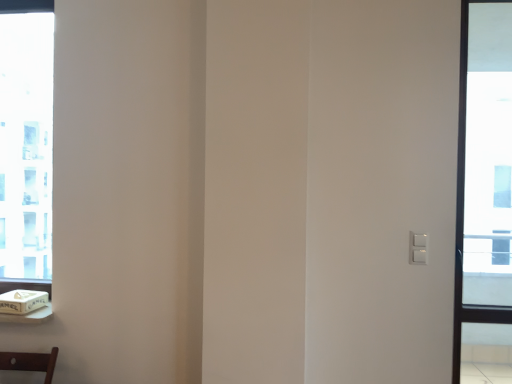
The height and width of the screenshot is (384, 512). Describe the element at coordinates (484, 184) in the screenshot. I see `transparent glass window at right, the first window from the front` at that location.

Describe the element at coordinates (26, 143) in the screenshot. I see `clear glass window at left, arranged as the second window when viewed from the front` at that location.

Find the location of `transparent glass window at right, which appears as the second window when viewed from the back`. transparent glass window at right, which appears as the second window when viewed from the back is located at coordinates pos(484,184).

Which object is wider, transparent glass window at right, arranged as the 1th window when viewed from the right, or clear glass window at left, the 2th window in the right-to-left sequence?

Wider between the two is transparent glass window at right, arranged as the 1th window when viewed from the right.

Are transparent glass window at right, the 2th window viewed from the left, and clear glass window at left, positioned as the first window in back-to-front order, far apart?

Yes, transparent glass window at right, the 2th window viewed from the left, and clear glass window at left, positioned as the first window in back-to-front order, are quite far apart.

From a real-world perspective, is white cardboard box at lower left below clear glass window at left, the 1th window positioned from the left?

Yes.

Is white cardboard box at lower left at the left side of clear glass window at left, the 1th window positioned from the left?

No, white cardboard box at lower left is not to the left of clear glass window at left, the 1th window positioned from the left.

Does white cardboard box at lower left come behind clear glass window at left, arranged as the second window when viewed from the front?

No.

Is clear glass window at left, the 2th window in the right-to-left sequence, surrounded by white cardboard box at lower left?

No, white cardboard box at lower left does not contain clear glass window at left, the 2th window in the right-to-left sequence.

Is the depth of clear glass window at left, the 1th window positioned from the left, greater than that of white cardboard box at lower left?

That is True.

From the image's perspective, is clear glass window at left, the 2th window in the right-to-left sequence, above or below white cardboard box at lower left?

Based on their image positions, clear glass window at left, the 2th window in the right-to-left sequence, is located above white cardboard box at lower left.

Can you confirm if clear glass window at left, positioned as the first window in back-to-front order, is positioned to the left of transparent glass window at right, the first window from the front?

Yes.

Is clear glass window at left, arranged as the second window when viewed from the front, oriented towards transparent glass window at right, which appears as the second window when viewed from the back?

No, clear glass window at left, arranged as the second window when viewed from the front, is not facing towards transparent glass window at right, which appears as the second window when viewed from the back.

Can we say clear glass window at left, positioned as the first window in back-to-front order, lies outside transparent glass window at right, arranged as the 1th window when viewed from the right?

Yes.

Consider the image. From a real-world perspective, which is physically below, clear glass window at left, the 2th window in the right-to-left sequence, or transparent glass window at right, the 2th window viewed from the left?

In real-world perspective, transparent glass window at right, the 2th window viewed from the left, is lower.

In the scene shown: Would you say white cardboard box at lower left contains transparent glass window at right, the 2th window viewed from the left?

No, transparent glass window at right, the 2th window viewed from the left, is not surrounded by white cardboard box at lower left.

From a real-world perspective, which is physically above, white cardboard box at lower left or transparent glass window at right, the first window from the front?

transparent glass window at right, the first window from the front, is physically above.

Is white cardboard box at lower left touching transparent glass window at right, the first window from the front?

No, white cardboard box at lower left is not with transparent glass window at right, the first window from the front.

Considering the relative sizes of white cardboard box at lower left and transparent glass window at right, arranged as the 1th window when viewed from the right, in the image provided, is white cardboard box at lower left wider than transparent glass window at right, arranged as the 1th window when viewed from the right,?

Indeed, white cardboard box at lower left has a greater width compared to transparent glass window at right, arranged as the 1th window when viewed from the right.

Is transparent glass window at right, the 2th window viewed from the left, positioned with its back to white cardboard box at lower left?

No.

Is point (497, 154) farther from viewer compared to point (29, 303)?

Yes.

From the picture: Considering the positions of objects transparent glass window at right, the 2th window viewed from the left, and white cardboard box at lower left in the image provided, who is more to the right, transparent glass window at right, the 2th window viewed from the left, or white cardboard box at lower left?

Positioned to the right is transparent glass window at right, the 2th window viewed from the left.

Where is `window on the right of clear glass window at left, the 1th window positioned from the left`? This screenshot has height=384, width=512. window on the right of clear glass window at left, the 1th window positioned from the left is located at coordinates (484, 184).

From a real-world perspective, count 2nd windows upward from the white cardboard box at lower left and point to it. Please provide its 2D coordinates.

[(26, 143)]

From the image, which object appears to be nearer to white cardboard box at lower left, clear glass window at left, the 1th window positioned from the left, or transparent glass window at right, the first window from the front?

clear glass window at left, the 1th window positioned from the left, is closer to white cardboard box at lower left.

From the image, which object appears to be nearer to transparent glass window at right, the 2th window viewed from the left, white cardboard box at lower left or clear glass window at left, the 1th window positioned from the left?

clear glass window at left, the 1th window positioned from the left.

When comparing their distances from clear glass window at left, the 2th window in the right-to-left sequence, does white cardboard box at lower left or transparent glass window at right, arranged as the 1th window when viewed from the right, seem closer?

white cardboard box at lower left lies closer to clear glass window at left, the 2th window in the right-to-left sequence, than the other object.

Considering their positions, is transparent glass window at right, which appears as the second window when viewed from the back, positioned closer to clear glass window at left, positioned as the first window in back-to-front order, than white cardboard box at lower left?

The object closer to clear glass window at left, positioned as the first window in back-to-front order, is white cardboard box at lower left.

From the image, which object appears to be farther from white cardboard box at lower left, transparent glass window at right, the 2th window viewed from the left, or clear glass window at left, positioned as the first window in back-to-front order?

Answer: transparent glass window at right, the 2th window viewed from the left, lies further to white cardboard box at lower left than the other object.

From the image, which object appears to be nearer to transparent glass window at right, the first window from the front, clear glass window at left, the 2th window in the right-to-left sequence, or white cardboard box at lower left?

clear glass window at left, the 2th window in the right-to-left sequence, lies closer to transparent glass window at right, the first window from the front, than the other object.

Find the location of a particular element. Image resolution: width=512 pixels, height=384 pixels. box between clear glass window at left, arranged as the second window when viewed from the front, and transparent glass window at right, which appears as the second window when viewed from the back, from left to right is located at coordinates (22, 301).